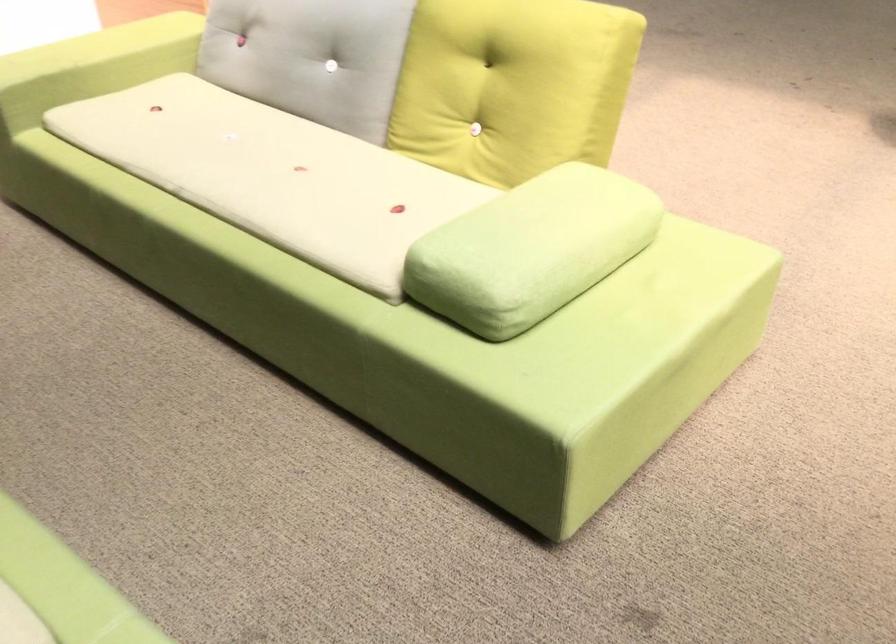
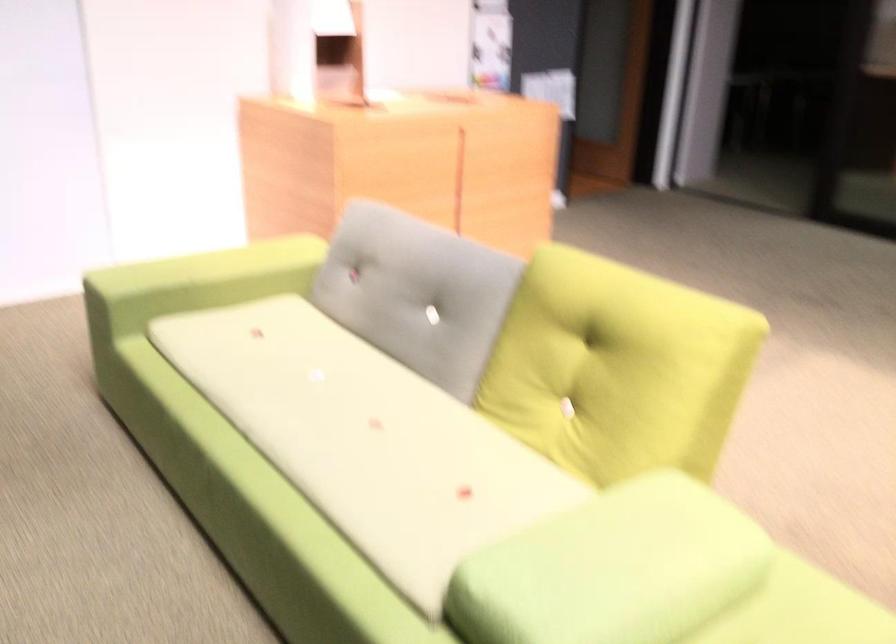
Locate, in the second image, the point that corresponds to the point at 82,70 in the first image.

(194, 283)